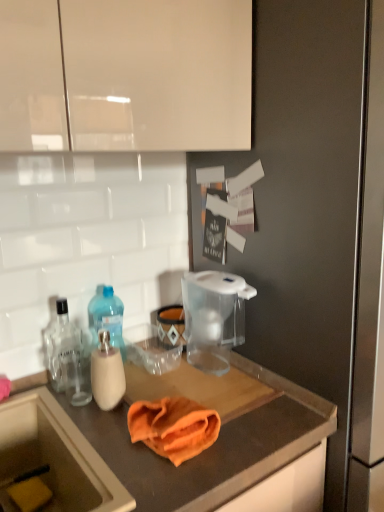
What is the approximate width of transparent plastic water filter pitcher at center?

transparent plastic water filter pitcher at center is 11.70 inches wide.

From the picture: Measure the distance between orange fabric at center and camera.

orange fabric at center and camera are 28.54 inches apart from each other.

What do you see at coordinates (217, 440) in the screenshot? The height and width of the screenshot is (512, 384). I see `orange fabric at center` at bounding box center [217, 440].

Where is `orange microfiber cloth at center`? orange microfiber cloth at center is located at coordinates (173, 426).

Image resolution: width=384 pixels, height=512 pixels. What do you see at coordinates (30, 494) in the screenshot?
I see `yellow sponge at lower left` at bounding box center [30, 494].

Where is `translucent plastic bottle at left, which is the second bottle in left-to-right order`? This screenshot has height=512, width=384. translucent plastic bottle at left, which is the second bottle in left-to-right order is located at coordinates (107, 317).

Locate an element on the screen. Image resolution: width=384 pixels, height=512 pixels. transparent plastic water filter pitcher at center is located at coordinates (214, 317).

Can you confirm if clear glass bottle at left, marked as the 1th bottle in a left-to-right arrangement, is shorter than transparent plastic pitcher at upper center?

Indeed, clear glass bottle at left, marked as the 1th bottle in a left-to-right arrangement, has a lesser height compared to transparent plastic pitcher at upper center.

Consider the image. From the image's perspective, which object appears higher, clear glass bottle at left, which is the 2th bottle from right to left, or transparent plastic pitcher at upper center?

Result: clear glass bottle at left, which is the 2th bottle from right to left, is shown above in the image.

You are a GUI agent. You are given a task and a screenshot of the screen. Output one action in this format:
    pyautogui.click(x=<x>, y=<y>)
    Task: Click on the bottle that is the 1st one above the transparent plastic pitcher at upper center (from a real-world perspective)
    
    Given the screenshot: What is the action you would take?
    pyautogui.click(x=61, y=345)

From the picture: Would you say clear glass bottle at left, marked as the 1th bottle in a left-to-right arrangement, is outside transparent plastic pitcher at upper center?

Yes, clear glass bottle at left, marked as the 1th bottle in a left-to-right arrangement, is outside of transparent plastic pitcher at upper center.

Based on the photo, from the image's perspective, does translucent plastic bottle at left, which is the second bottle in left-to-right order, appear lower than orange fabric at center?

Incorrect, from the image's perspective, translucent plastic bottle at left, which is the second bottle in left-to-right order, is higher than orange fabric at center.

Does translucent plastic bottle at left, which is the second bottle in left-to-right order, turn towards orange fabric at center?

No, translucent plastic bottle at left, which is the second bottle in left-to-right order, is not facing towards orange fabric at center.

Is point (124, 350) positioned in front of point (259, 466)?

No.

How distant is translucent plastic bottle at left, the 1th bottle positioned from the right, from orange fabric at center?

36.74 centimeters.

Considering the relative sizes of yellow sponge at lower left and orange fabric at center in the image provided, is yellow sponge at lower left bigger than orange fabric at center?

Actually, yellow sponge at lower left might be smaller than orange fabric at center.

In the scene shown: Can you tell me how much yellow sponge at lower left and orange fabric at center differ in facing direction?

5.84 degrees separate the facing orientations of yellow sponge at lower left and orange fabric at center.

Who is taller, yellow sponge at lower left or orange fabric at center?

orange fabric at center.

Is yellow sponge at lower left wider than orange fabric at center?

No.

Is orange microfiber cloth at center to the left of translucent plastic bottle at left, which is the second bottle in left-to-right order, from the viewer's perspective?

No, orange microfiber cloth at center is not to the left of translucent plastic bottle at left, which is the second bottle in left-to-right order.

In the image, there is a translucent plastic bottle at left, the 1th bottle positioned from the right. Where is `bath towel below it (from a real-world perspective)`? The height and width of the screenshot is (512, 384). bath towel below it (from a real-world perspective) is located at coordinates (173, 426).

How different are the orientations of orange microfiber cloth at center and translucent plastic bottle at left, which is the second bottle in left-to-right order, in degrees?

The angle between the facing direction of orange microfiber cloth at center and the facing direction of translucent plastic bottle at left, which is the second bottle in left-to-right order, is 1.45 degrees.

Does orange microfiber cloth at center have a greater height compared to translucent plastic bottle at left, which is the second bottle in left-to-right order?

No.

Considering the sizes of objects transparent plastic pitcher at upper center and orange microfiber cloth at center in the image provided, who is smaller, transparent plastic pitcher at upper center or orange microfiber cloth at center?

orange microfiber cloth at center.

Could orange microfiber cloth at center be considered to be inside transparent plastic pitcher at upper center?

No, orange microfiber cloth at center is not surrounded by transparent plastic pitcher at upper center.

From the image's perspective, who appears lower, transparent plastic pitcher at upper center or orange microfiber cloth at center?

orange microfiber cloth at center is shown below in the image.

Is transparent plastic pitcher at upper center closer to camera compared to orange microfiber cloth at center?

Yes.

From the image's perspective, is clear glass bottle at left, which is the 2th bottle from right to left, over orange microfiber cloth at center?

Correct, clear glass bottle at left, which is the 2th bottle from right to left, appears higher than orange microfiber cloth at center in the image.

Which of these two, clear glass bottle at left, which is the 2th bottle from right to left, or orange microfiber cloth at center, is bigger?

clear glass bottle at left, which is the 2th bottle from right to left, is bigger.

Considering the relative positions of clear glass bottle at left, marked as the 1th bottle in a left-to-right arrangement, and orange microfiber cloth at center in the image provided, is clear glass bottle at left, marked as the 1th bottle in a left-to-right arrangement, to the left or to the right of orange microfiber cloth at center?

clear glass bottle at left, marked as the 1th bottle in a left-to-right arrangement, is to the left of orange microfiber cloth at center.

Is transparent plastic water filter pitcher at center at the back of orange microfiber cloth at center?

No, orange microfiber cloth at center's orientation is not away from transparent plastic water filter pitcher at center.

How many degrees apart are the facing directions of orange microfiber cloth at center and transparent plastic water filter pitcher at center?

1.45 degrees.

From the image's perspective, does orange microfiber cloth at center appear lower than transparent plastic water filter pitcher at center?

Yes, from the image's perspective, orange microfiber cloth at center is below transparent plastic water filter pitcher at center.

Is orange microfiber cloth at center not inside transparent plastic water filter pitcher at center?

orange microfiber cloth at center is positioned outside transparent plastic water filter pitcher at center.

Image resolution: width=384 pixels, height=512 pixels. What are the coordinates of `fridge below the clear glass bottle at left, marked as the 1th bottle in a left-to-right arrangement (from the image's perspective)` in the screenshot? It's located at (318, 221).

I want to click on the 2nd bottle above the orange fabric at center (from a real-world perspective), so click(107, 317).

Which object lies further to the anchor point clear glass bottle at left, marked as the 1th bottle in a left-to-right arrangement, transparent plastic pitcher at upper center or orange fabric at center?

transparent plastic pitcher at upper center.

Considering their positions, is transparent plastic pitcher at upper center positioned closer to transparent plastic water filter pitcher at center than yellow sponge at lower left?

Among the two, transparent plastic pitcher at upper center is located nearer to transparent plastic water filter pitcher at center.

When comparing their distances from orange microfiber cloth at center, does transparent plastic water filter pitcher at center or orange fabric at center seem further?

transparent plastic water filter pitcher at center.

Estimate the real-world distances between objects in this image. Which object is closer to yellow sponge at lower left, translucent plastic bottle at left, the 1th bottle positioned from the right, or orange fabric at center?

orange fabric at center is positioned closer to the anchor yellow sponge at lower left.

Which object lies further to the anchor point transparent plastic water filter pitcher at center, yellow sponge at lower left or transparent plastic pitcher at upper center?

Based on the image, yellow sponge at lower left appears to be further to transparent plastic water filter pitcher at center.

Estimate the real-world distances between objects in this image. Which object is closer to orange microfiber cloth at center, clear glass bottle at left, which is the 2th bottle from right to left, or transparent plastic pitcher at upper center?

clear glass bottle at left, which is the 2th bottle from right to left, is closer to orange microfiber cloth at center.

Which object lies further to the anchor point yellow sponge at lower left, transparent plastic water filter pitcher at center or translucent plastic bottle at left, which is the second bottle in left-to-right order?

transparent plastic water filter pitcher at center lies further to yellow sponge at lower left than the other object.

Looking at this image, from the image, which object appears to be farther from orange fabric at center, orange microfiber cloth at center or translucent plastic bottle at left, the 1th bottle positioned from the right?

translucent plastic bottle at left, the 1th bottle positioned from the right, lies further to orange fabric at center than the other object.

Find the location of a particular element. This screenshot has height=512, width=384. bath towel situated between translucent plastic bottle at left, which is the second bottle in left-to-right order, and transparent plastic pitcher at upper center from left to right is located at coordinates coord(173,426).

Find the location of `appliance between yellow sponge at lower left and transparent plastic pitcher at upper center`. appliance between yellow sponge at lower left and transparent plastic pitcher at upper center is located at coordinates (214, 317).

Locate an element on the screen. The height and width of the screenshot is (512, 384). bottle situated between clear glass bottle at left, marked as the 1th bottle in a left-to-right arrangement, and transparent plastic water filter pitcher at center from left to right is located at coordinates (107, 317).

Where is `appliance between orange microfiber cloth at center and transparent plastic pitcher at upper center in the horizontal direction`? appliance between orange microfiber cloth at center and transparent plastic pitcher at upper center in the horizontal direction is located at coordinates (214, 317).